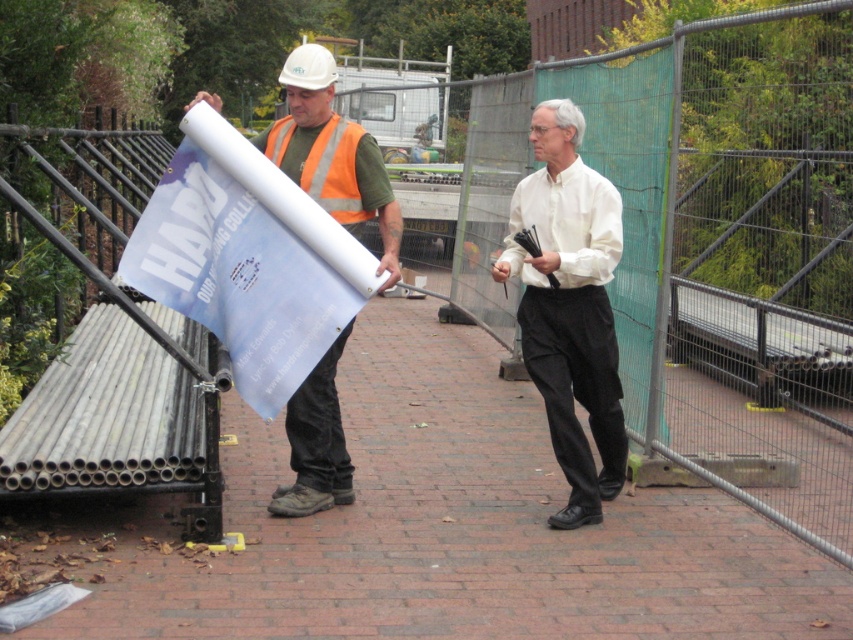
Which of these two, white smooth shirt at center or matte white hard hat at center, stands shorter?

With less height is matte white hard hat at center.

Which of these two, white smooth shirt at center or matte white hard hat at center, stands taller?

Standing taller between the two is white smooth shirt at center.

Who is more forward, (x=553, y=268) or (x=323, y=193)?

Point (x=553, y=268)

Where is `white smooth shirt at center`? The height and width of the screenshot is (640, 853). white smooth shirt at center is located at coordinates (569, 305).

Can you confirm if white smooth shirt at center is shorter than orange reflective safety vest at center?

In fact, white smooth shirt at center may be taller than orange reflective safety vest at center.

Is point (575, 256) farther from camera compared to point (282, 154)?

No.

The height and width of the screenshot is (640, 853). What do you see at coordinates (569, 305) in the screenshot?
I see `white smooth shirt at center` at bounding box center [569, 305].

Where is `white smooth shirt at center`? Image resolution: width=853 pixels, height=640 pixels. white smooth shirt at center is located at coordinates (569, 305).

Who is positioned more to the left, matte white hard hat at center or orange reflective safety vest at center?

orange reflective safety vest at center

Between matte white hard hat at center and orange reflective safety vest at center, which one is positioned lower?

matte white hard hat at center

Who is more distant from viewer, [294,163] or [364,209]?

Point [364,209]

Where is `matte white hard hat at center`? The width and height of the screenshot is (853, 640). matte white hard hat at center is located at coordinates (331, 154).